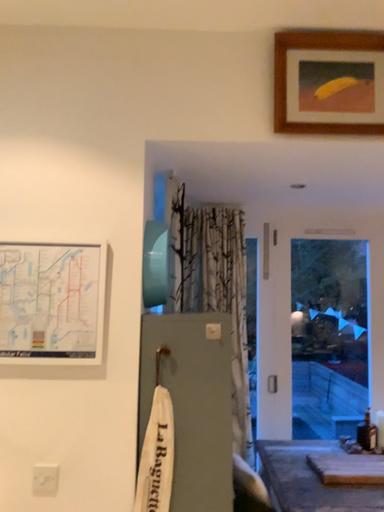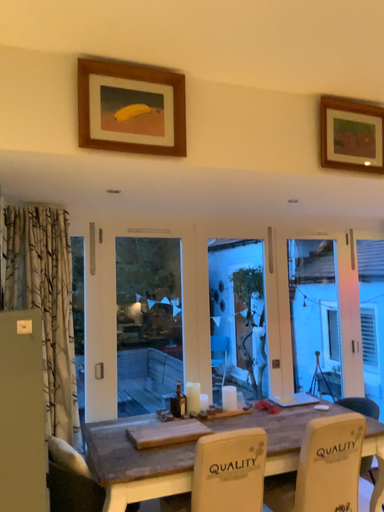
Question: How did the camera likely rotate when shooting the video?

Choices:
 (A) rotated right
 (B) rotated left

Answer: (A)